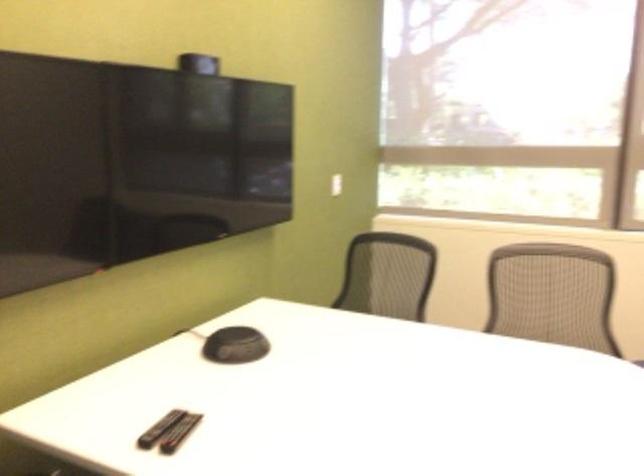
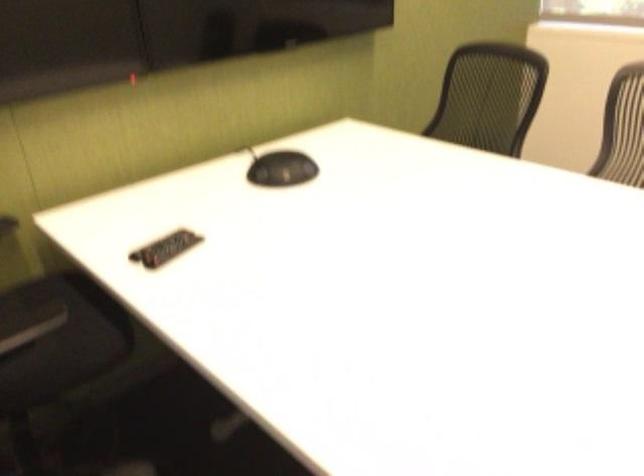
The point at (242, 346) is marked in the first image. Where is the corresponding point in the second image?

(281, 169)